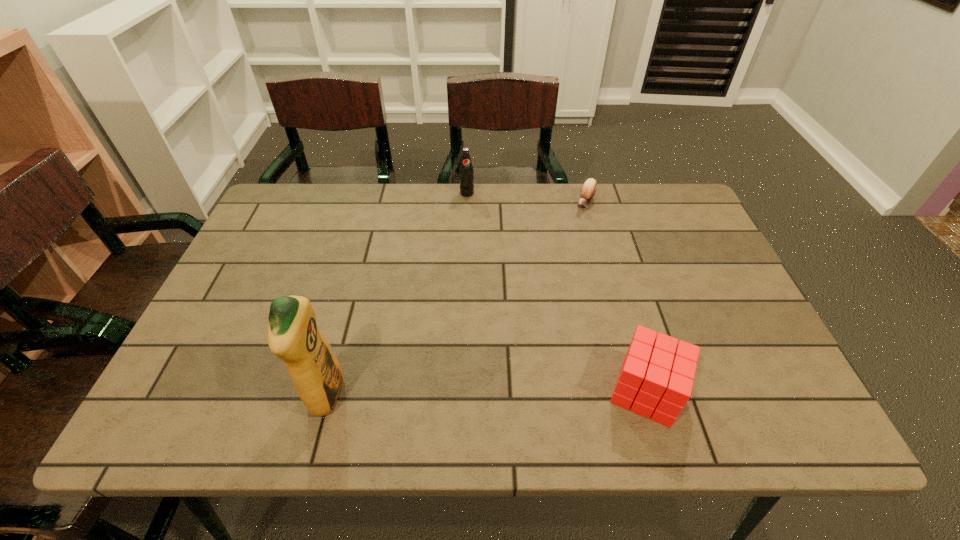
The width and height of the screenshot is (960, 540). I want to click on empty location between the cube and the second tallest object, so click(557, 292).

Where is `vacant space in between the cube and the third shortest object`? This screenshot has width=960, height=540. vacant space in between the cube and the third shortest object is located at coordinates (557, 292).

Identify which object is located as the third nearest to the third tallest object. Please provide its 2D coordinates. Your answer should be formatted as a tuple, i.e. [(x, y)], where the tuple contains the x and y coordinates of a point satisfying the conditions above.

[(466, 172)]

What are the coordinates of `the second closest object to the detergent` in the screenshot? It's located at (466, 172).

The image size is (960, 540). I want to click on vacant region that satisfies the following two spatial constraints: 1. on the front side of the cube; 2. on the right side of the third object from right to left, so click(x=460, y=391).